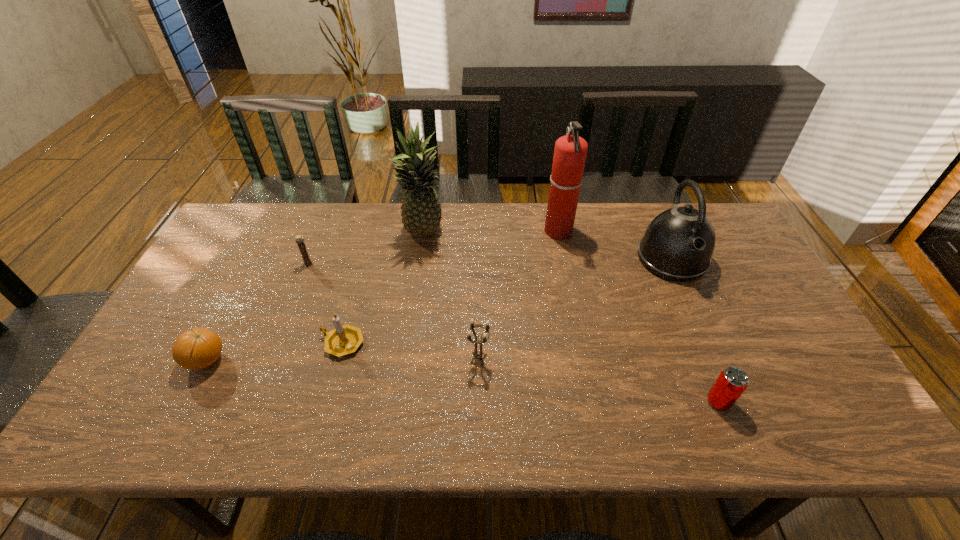
Locate an element on the screen. blank area located with the nozzle and gauge on the fire extinguisher is located at coordinates (493, 232).

This screenshot has width=960, height=540. What are the coordinates of `free space located with the nozzle and gauge on the fire extinguisher` in the screenshot? It's located at (517, 232).

Where is `blank space located 0.350m on the right of the pineapple`? This screenshot has width=960, height=540. blank space located 0.350m on the right of the pineapple is located at coordinates (553, 233).

Locate an element on the screen. Image resolution: width=960 pixels, height=540 pixels. vacant space located 0.250m on the spout of the sixth shortest object is located at coordinates (716, 357).

Identify the location of free space located 0.280m on the left of the rightmost candle holder. Image resolution: width=960 pixels, height=540 pixels. (356, 359).

You are a GUI agent. You are given a task and a screenshot of the screen. Output one action in this format:
    pyautogui.click(x=<x>, y=<y>)
    Task: Click on the free space located on the left of the sixth object from right to left
    Image resolution: width=960 pixels, height=540 pixels.
    Given the screenshot: What is the action you would take?
    pyautogui.click(x=262, y=343)

Where is `vacant point located on the front of the farthest candle holder`? This screenshot has width=960, height=540. vacant point located on the front of the farthest candle holder is located at coordinates (268, 364).

I want to click on free space located on the right of the soda can, so click(825, 401).

Where is `vacant point located 0.400m on the right of the leftmost object`? The height and width of the screenshot is (540, 960). vacant point located 0.400m on the right of the leftmost object is located at coordinates (385, 361).

At what (x,y) coordinates should I click in order to perform the action: click on fire extinguisher that is at the far edge. Please return your answer as a coordinate pair (x, y). Image resolution: width=960 pixels, height=540 pixels. Looking at the image, I should click on (570, 151).